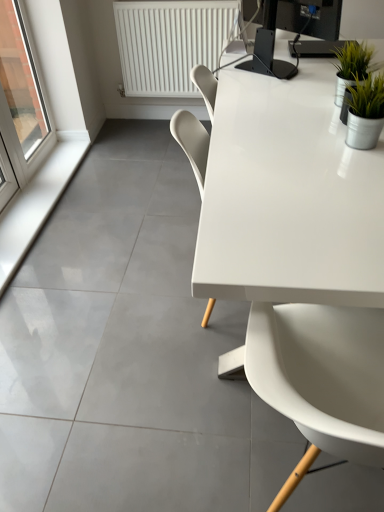
Find the location of a particular element. This screenshot has width=384, height=512. vacant space in between black glossy monitor at upper right and green metallic pot at upper right is located at coordinates (295, 86).